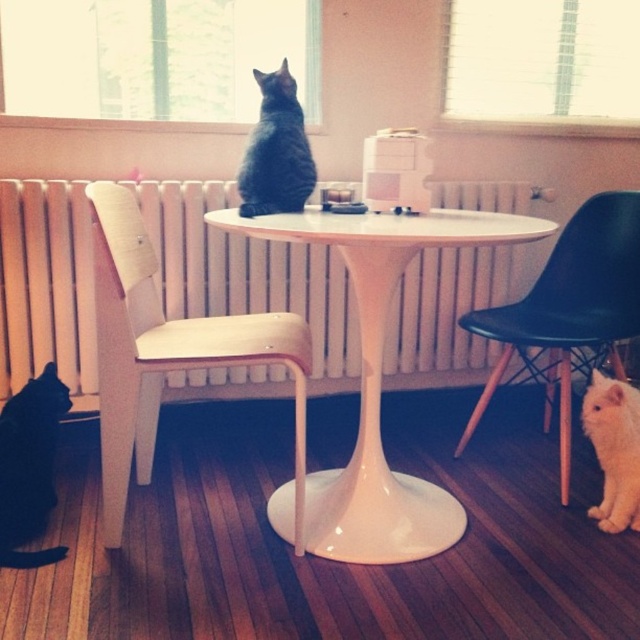
Between black fur cat at lower left and white fluffy cat at lower right, which one has more height?

Standing taller between the two is black fur cat at lower left.

Is black fur cat at lower left thinner than white fluffy cat at lower right?

In fact, black fur cat at lower left might be wider than white fluffy cat at lower right.

Which is behind, point (38, 458) or point (636, 524)?

Point (38, 458)

Image resolution: width=640 pixels, height=640 pixels. I want to click on black fur cat at lower left, so click(x=29, y=467).

Is white painted metal radiator at center in front of white wood chair at left?

That is False.

Does white painted metal radiator at center have a greater width compared to white wood chair at left?

Indeed, white painted metal radiator at center has a greater width compared to white wood chair at left.

Who is more forward, (49, 189) or (300, 477)?

Point (300, 477) is in front.

Find the location of a particular element. The image size is (640, 640). white painted metal radiator at center is located at coordinates (248, 275).

Between point (300, 372) and point (561, 282), which one is positioned behind?

Point (561, 282)

Is white wood chair at left smaller than black plastic chair at lower right?

→ Indeed, white wood chair at left has a smaller size compared to black plastic chair at lower right.

The width and height of the screenshot is (640, 640). Identify the location of white wood chair at left. (166, 353).